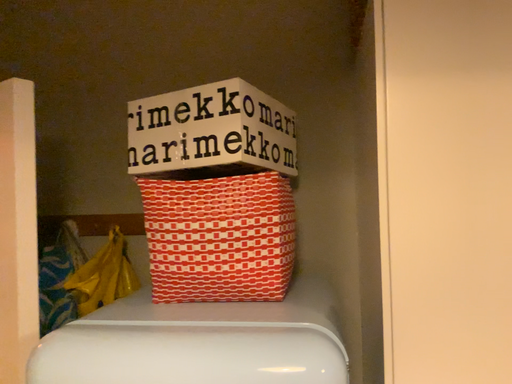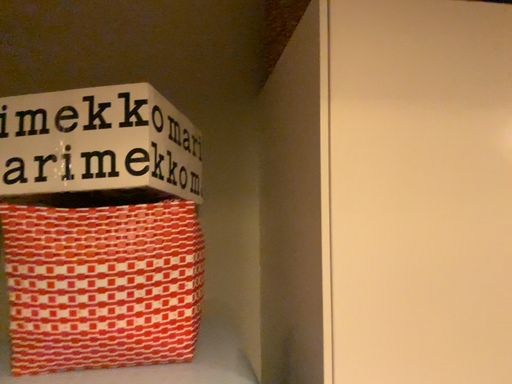
Question: Which way did the camera rotate in the video?

Choices:
 (A) rotated right
 (B) rotated left

Answer: (A)